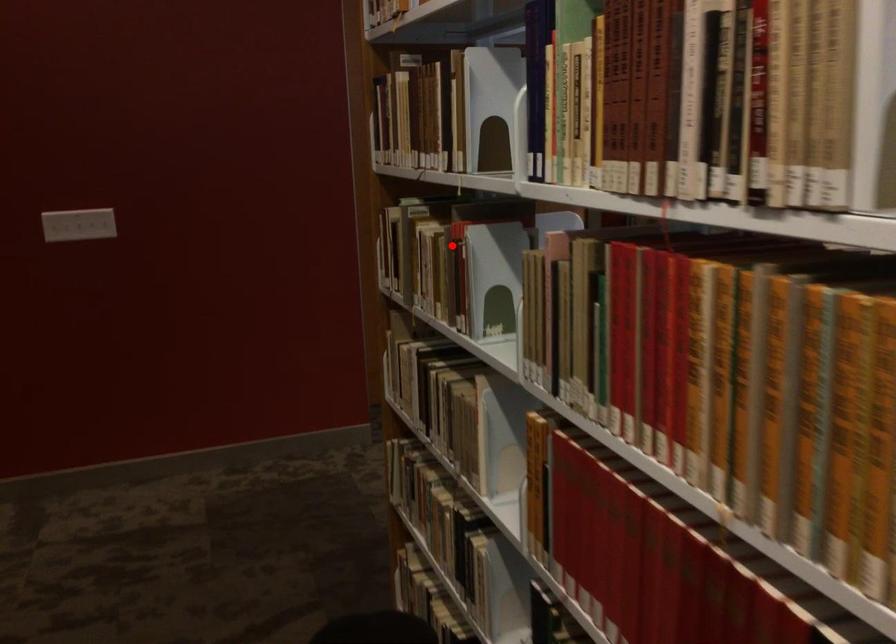
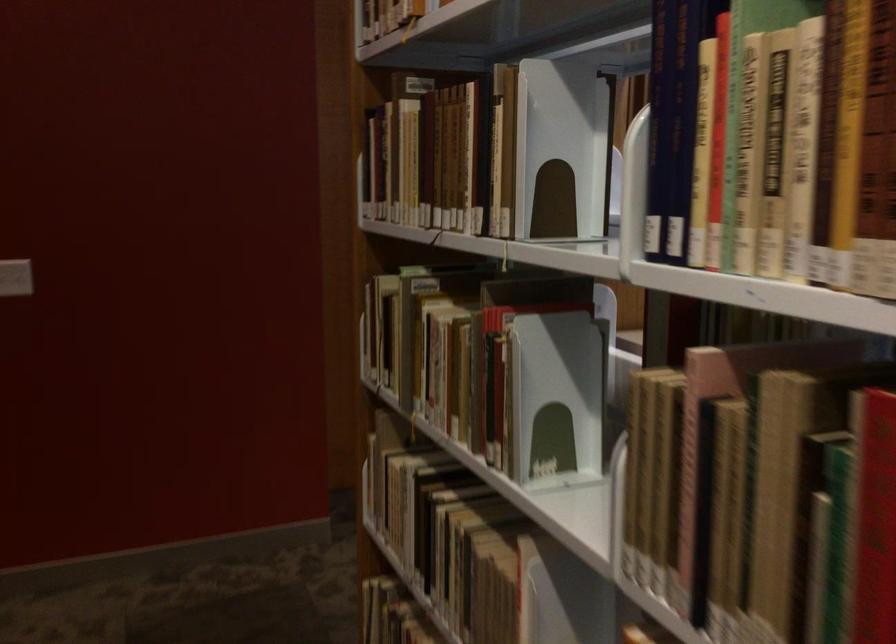
Question: I am providing you with two images of the same scene from different viewpoints. Image1 has a red point marked. In image2, the corresponding 3D location appears at what relative position? Reply with the corresponding letter.

Choices:
 (A) Closer
 (B) Farther

Answer: (A)